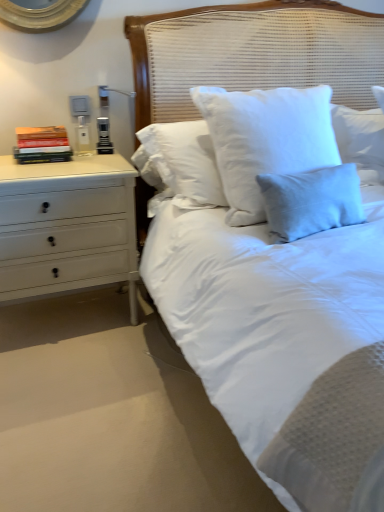
Question: From a real-world perspective, relative to white painted wood chest of drawers at left, is hardcover books at left vertically above or below?

Choices:
 (A) below
 (B) above

Answer: (B)

Question: From the image's perspective, is hardcover books at left above or below white painted wood chest of drawers at left?

Choices:
 (A) above
 (B) below

Answer: (A)

Question: Which of these objects is positioned closest to the white painted wood chest of drawers at left?

Choices:
 (A) hardcover books at left
 (B) white woven headboard at center

Answer: (A)

Question: Based on their relative distances, which object is farther from the white woven headboard at center?

Choices:
 (A) white painted wood chest of drawers at left
 (B) hardcover books at left

Answer: (B)